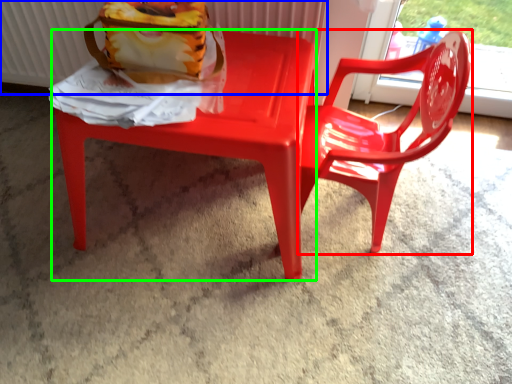
Question: Which is farther away from chair (highlighted by a red box)? radiator (highlighted by a blue box) or chair (highlighted by a green box)?

Choices:
 (A) radiator
 (B) chair

Answer: (A)